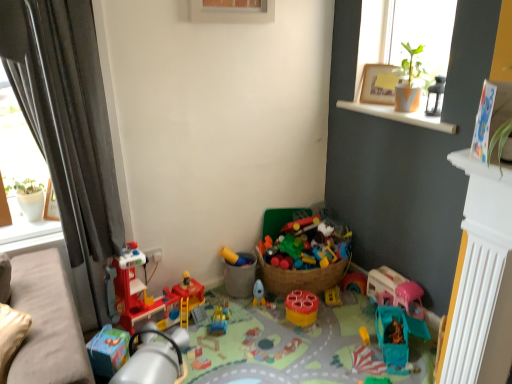
This screenshot has width=512, height=384. In order to click on empty space that is in between matte yellow plastic toy at center, which ranks as the 4th toy in right-to-left order, and translucent plastic slide at center, placed as the 6th toy when sorted from right to left in this screenshot , I will do `click(231, 306)`.